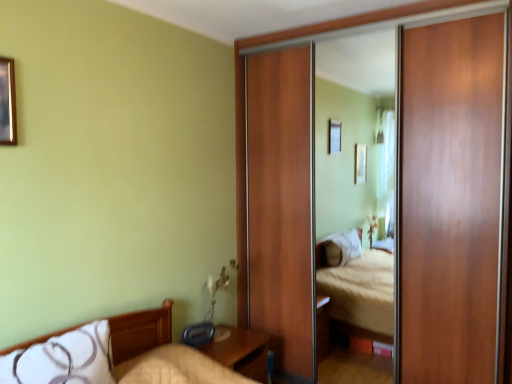
Question: Is wooden picture frame at upper left beside wooden sliding door at right?

Choices:
 (A) yes
 (B) no

Answer: (B)

Question: Could you tell me if wooden picture frame at upper left is facing wooden sliding door at right?

Choices:
 (A) no
 (B) yes

Answer: (A)

Question: Is the position of wooden picture frame at upper left less distant than that of wooden sliding door at right?

Choices:
 (A) no
 (B) yes

Answer: (B)

Question: Is wooden picture frame at upper left looking in the opposite direction of wooden sliding door at right?

Choices:
 (A) no
 (B) yes

Answer: (A)

Question: Considering the relative sizes of wooden picture frame at upper left and wooden sliding door at right in the image provided, is wooden picture frame at upper left bigger than wooden sliding door at right?

Choices:
 (A) no
 (B) yes

Answer: (A)

Question: From a real-world perspective, is wooden nightstand at lower center positioned above or below wooden sliding door at right?

Choices:
 (A) below
 (B) above

Answer: (A)

Question: Is wooden nightstand at lower center in front of or behind wooden sliding door at right in the image?

Choices:
 (A) behind
 (B) front

Answer: (A)

Question: From the image's perspective, is wooden nightstand at lower center located above or below wooden sliding door at right?

Choices:
 (A) below
 (B) above

Answer: (A)

Question: Is point (205, 354) closer or farther from the camera than point (243, 266)?

Choices:
 (A) closer
 (B) farther

Answer: (A)

Question: Do you think wooden sliding door at right is within white soft pillow at lower left, or outside of it?

Choices:
 (A) outside
 (B) inside

Answer: (A)

Question: Is wooden sliding door at right in front of or behind white soft pillow at lower left in the image?

Choices:
 (A) front
 (B) behind

Answer: (B)

Question: From the image's perspective, is wooden sliding door at right located above or below white soft pillow at lower left?

Choices:
 (A) below
 (B) above

Answer: (B)

Question: Is wooden sliding door at right wider or thinner than white soft pillow at lower left?

Choices:
 (A) wide
 (B) thin

Answer: (B)

Question: Is wooden picture frame at upper left bigger or smaller than white soft pillow at lower left?

Choices:
 (A) big
 (B) small

Answer: (B)

Question: From the image's perspective, is wooden picture frame at upper left positioned above or below white soft pillow at lower left?

Choices:
 (A) below
 (B) above

Answer: (B)